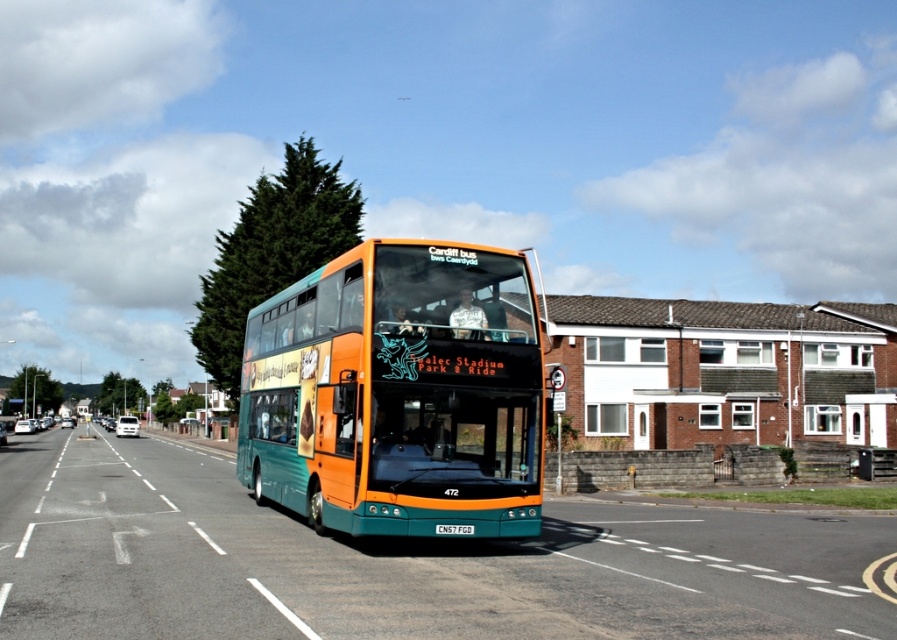
Question: Is teal glossy bus at center above white plastic license plate at center?

Choices:
 (A) yes
 (B) no

Answer: (A)

Question: Which point appears farthest from the camera in this image?

Choices:
 (A) (438, 529)
 (B) (363, 346)

Answer: (B)

Question: Can you confirm if teal glossy bus at center is positioned to the right of white plastic license plate at center?

Choices:
 (A) no
 (B) yes

Answer: (A)

Question: Which point is closer to the camera taking this photo?

Choices:
 (A) (434, 529)
 (B) (336, 298)

Answer: (A)

Question: Considering the relative positions of teal glossy bus at center and white plastic license plate at center in the image provided, where is teal glossy bus at center located with respect to white plastic license plate at center?

Choices:
 (A) below
 (B) above

Answer: (B)

Question: Which point is closer to the camera taking this photo?

Choices:
 (A) (440, 524)
 (B) (424, 429)

Answer: (A)